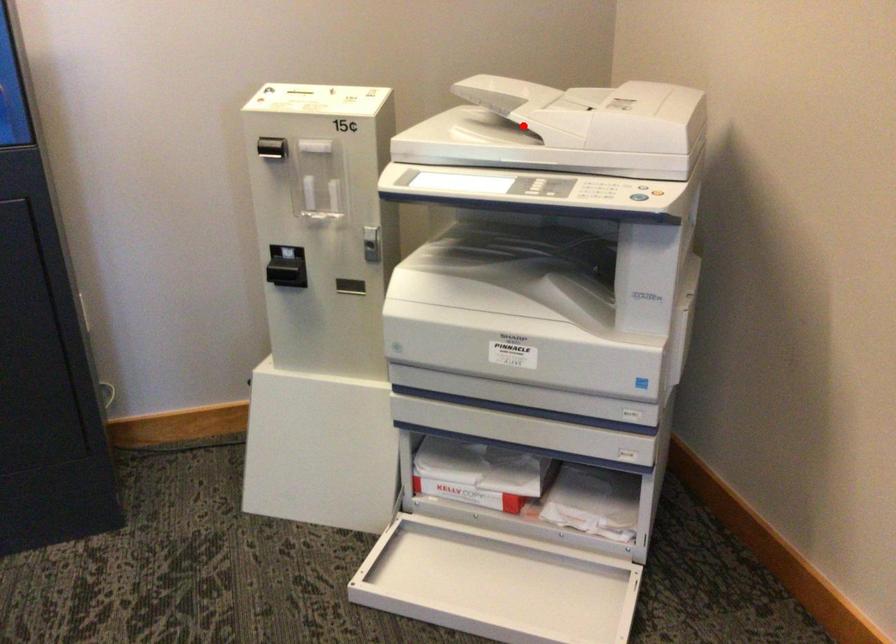
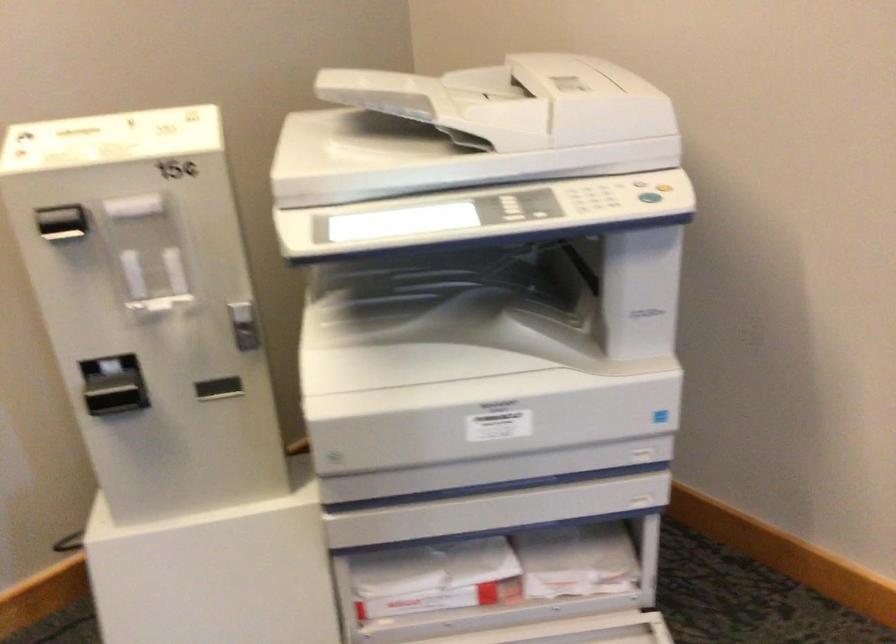
Find the pixel in the second image that matches the highlighted location in the first image.

(470, 129)